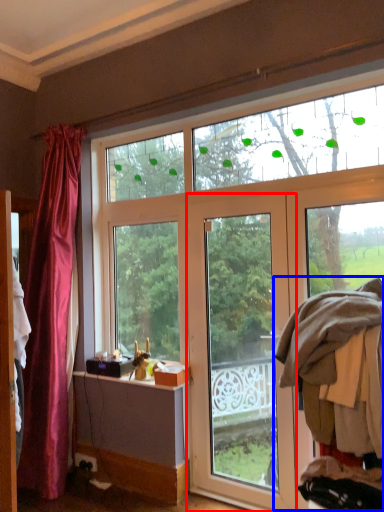
Question: Among these objects, which one is farthest to the camera, door (highlighted by a red box) or laundry (highlighted by a blue box)?

Choices:
 (A) door
 (B) laundry

Answer: (A)